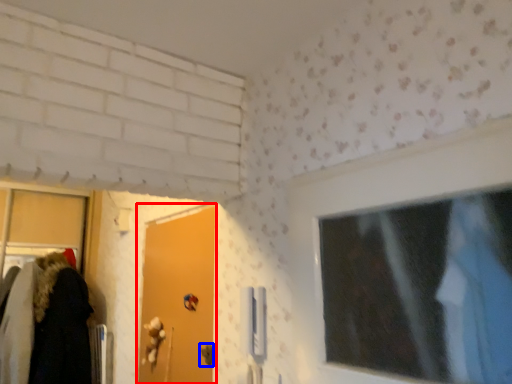
Question: Which object is further to the camera taking this photo, door (highlighted by a red box) or door handle (highlighted by a blue box)?

Choices:
 (A) door
 (B) door handle

Answer: (B)